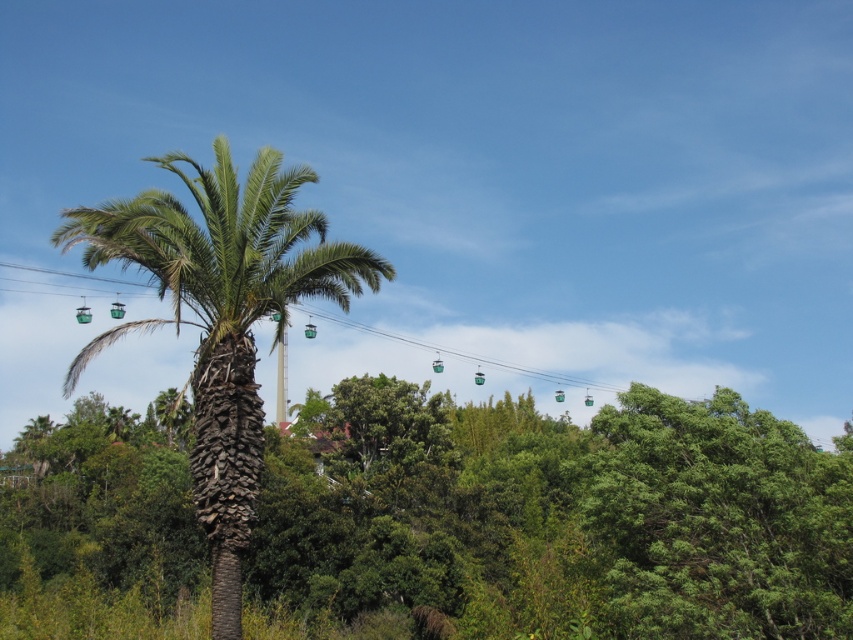
Is point (648, 604) more distant than point (312, 312)?

That is False.

Is green leafy tree at center above green cable car at center?

Actually, green leafy tree at center is below green cable car at center.

Who is more distant from viewer, (497, 465) or (296, 307)?

Positioned behind is point (296, 307).

You are a GUI agent. You are given a task and a screenshot of the screen. Output one action in this format:
    pyautogui.click(x=<x>, y=<y>)
    Task: Click on the green leafy tree at center
    
    Given the screenshot: What is the action you would take?
    550,520

Between green leafy tree at center and green textured palm tree at center, which one is positioned lower?

green leafy tree at center

Image resolution: width=853 pixels, height=640 pixels. I want to click on green leafy tree at center, so [550, 520].

This screenshot has height=640, width=853. I want to click on green leafy tree at center, so click(x=550, y=520).

Does green cable car at center have a larger size compared to green cable car at upper center?

Yes, green cable car at center is bigger than green cable car at upper center.

Which of these two, green cable car at center or green cable car at upper center, stands taller?

Standing taller between the two is green cable car at upper center.

Image resolution: width=853 pixels, height=640 pixels. Describe the element at coordinates (456, 352) in the screenshot. I see `green cable car at center` at that location.

What are the coordinates of `green cable car at center` in the screenshot? It's located at (456, 352).